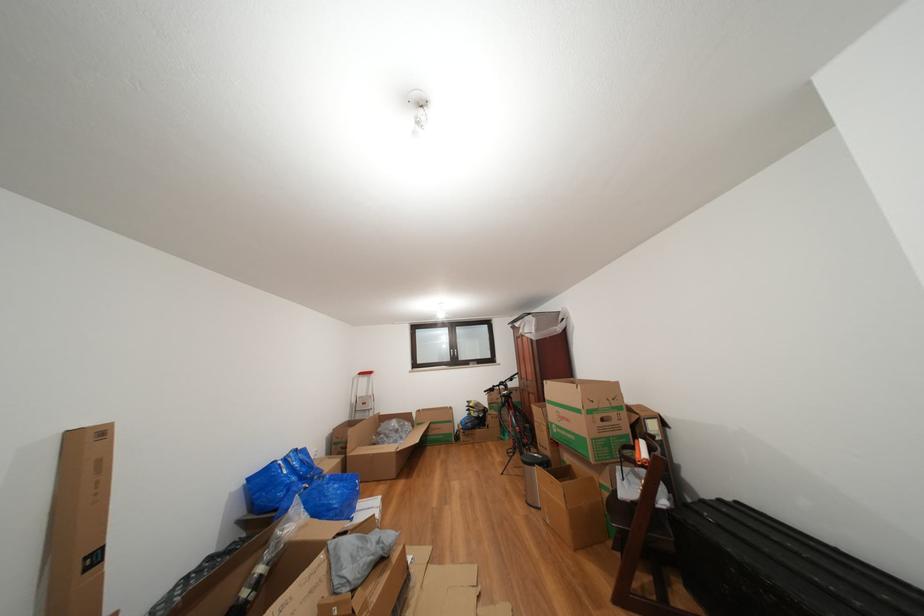
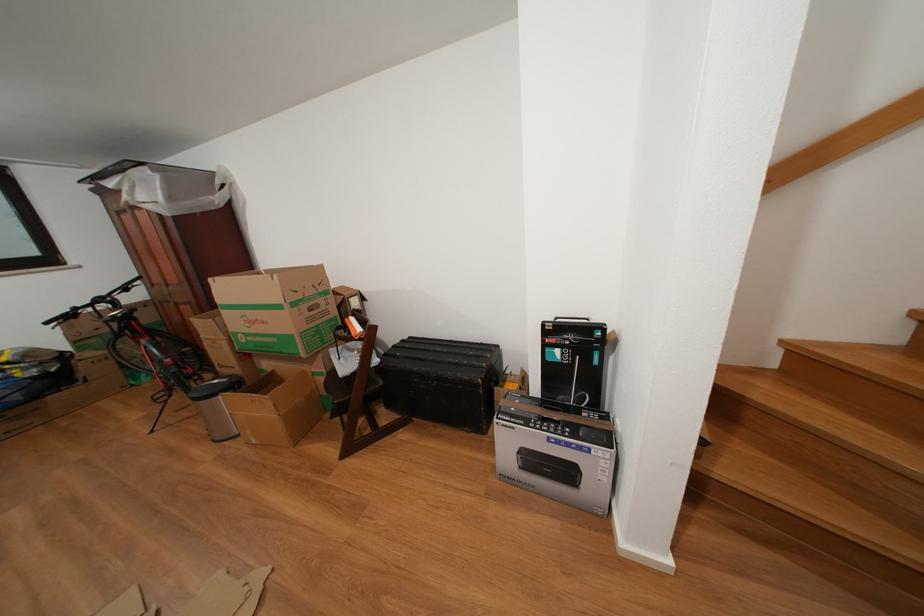
Locate, in the second image, the point that corresponds to pixel 576 426 in the first image.

(272, 328)